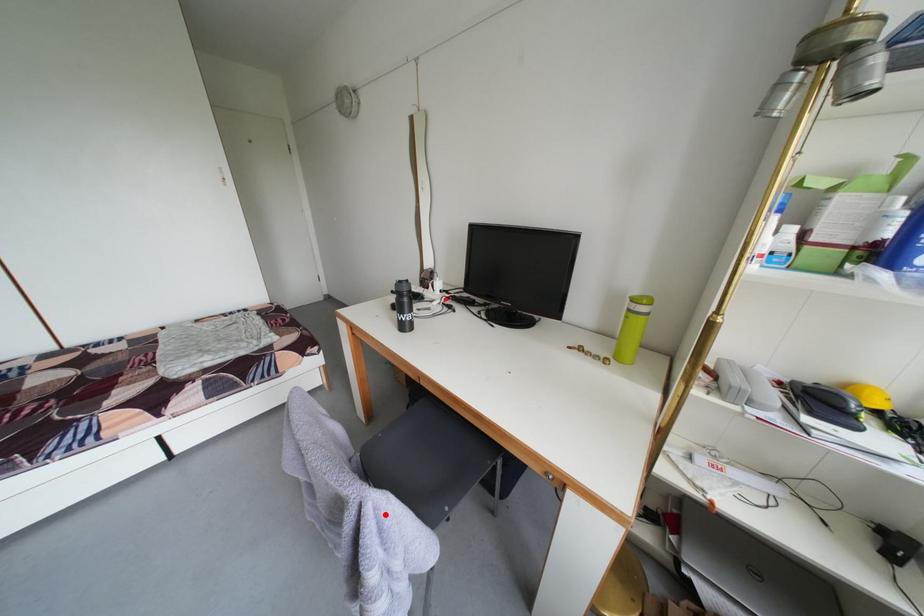
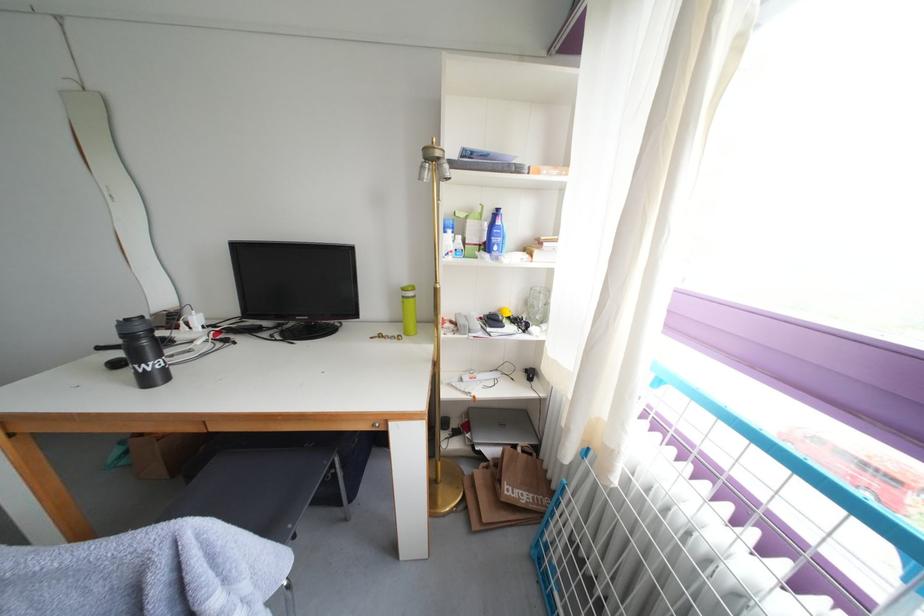
The point at the highlighted location is marked in the first image. Where is the corresponding point in the second image?

(208, 541)